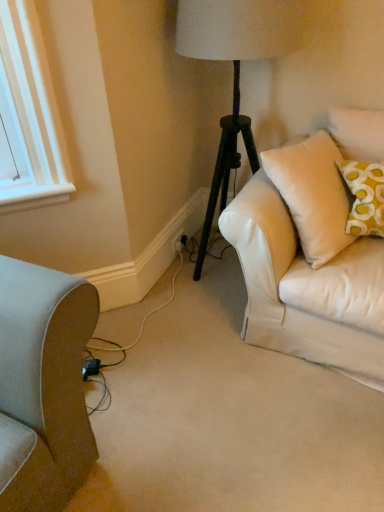
Question: Which direction should I rotate to look at black plastic electric outlet at lower center?

Choices:
 (A) left
 (B) right

Answer: (A)